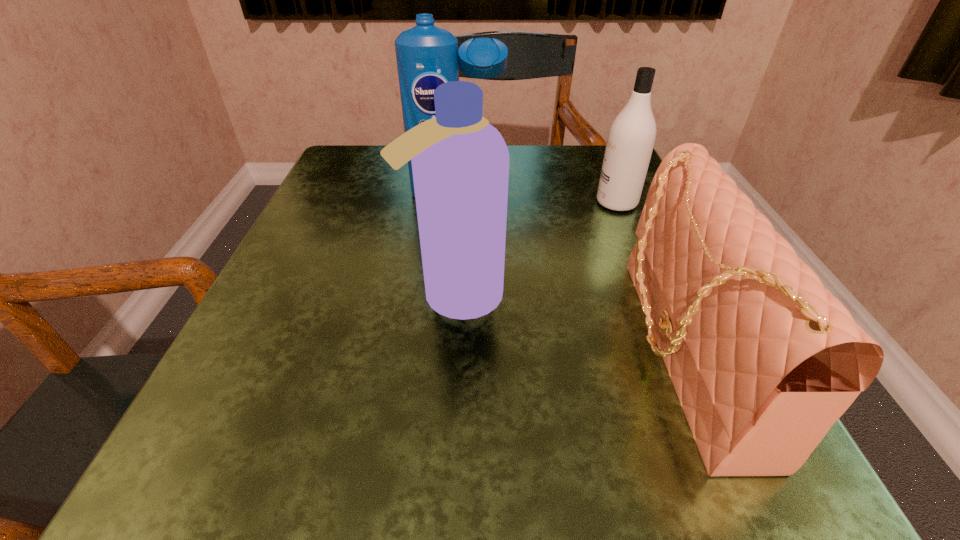
Locate an element on the screen. the nearest shampoo is located at coordinates (460, 163).

Locate an element on the screen. the shortest shampoo is located at coordinates (631, 137).

You are a GUI agent. You are given a task and a screenshot of the screen. Output one action in this format:
    pyautogui.click(x=<x>, y=<y>)
    Task: Click on the handbag
    Image resolution: width=960 pixels, height=540 pixels.
    Given the screenshot: What is the action you would take?
    pyautogui.click(x=764, y=360)

Locate an element on the screen. The height and width of the screenshot is (540, 960). vacant space located on the left of the nearest shampoo is located at coordinates (339, 297).

This screenshot has width=960, height=540. What are the coordinates of `vacant space positioned 0.370m on the front-facing side of the rightmost shampoo` in the screenshot? It's located at (405, 203).

This screenshot has height=540, width=960. What are the coordinates of `free space located 0.230m on the front-facing side of the rightmost shampoo` in the screenshot? It's located at (477, 203).

This screenshot has height=540, width=960. In order to click on vacant space located 0.120m on the front-facing side of the rightmost shampoo in this screenshot , I will do `click(534, 203)`.

What are the coordinates of `vacant area situated 0.370m on the front-facing side of the handbag` in the screenshot? It's located at (353, 350).

The width and height of the screenshot is (960, 540). What are the coordinates of `free location located 0.300m on the front-facing side of the handbag` in the screenshot? It's located at (406, 350).

Locate an element on the screen. Image resolution: width=960 pixels, height=540 pixels. vacant space located 0.280m on the front-facing side of the handbag is located at coordinates (421, 350).